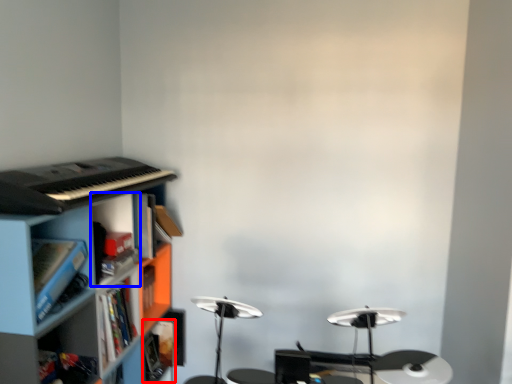
Question: Which of the following is the closest to the observer, book (highlighted by a red box) or cabinet (highlighted by a blue box)?

Choices:
 (A) book
 (B) cabinet

Answer: (B)